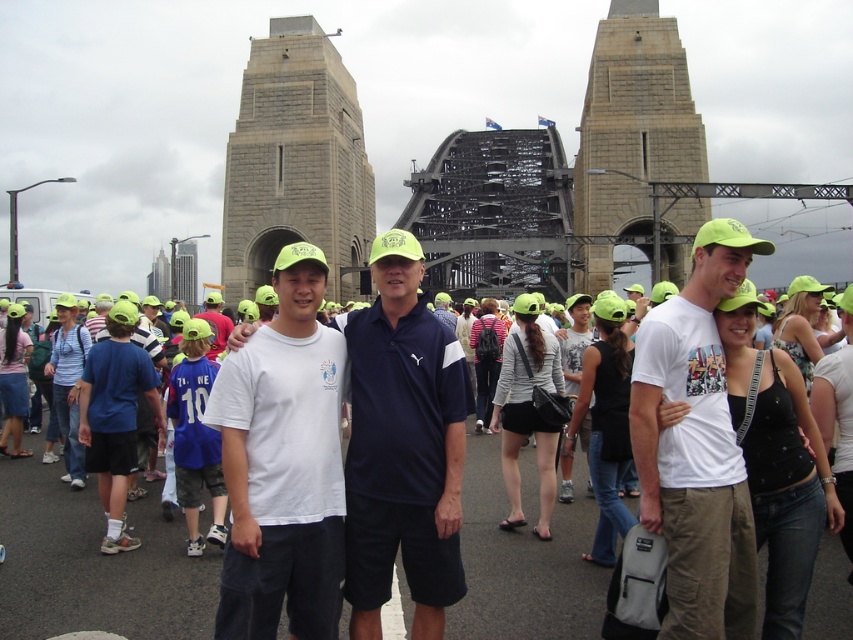
Question: Considering the real-world distances, which object is farthest from the white cotton t-shirt at center?

Choices:
 (A) white cotton shirt at center
 (B) white matte t-shirt at center

Answer: (B)

Question: Does white matte t-shirt at center have a lesser width compared to stone gray tower at center?

Choices:
 (A) yes
 (B) no

Answer: (A)

Question: Can you confirm if white matte t-shirt at center is positioned below white cotton shirt at center?

Choices:
 (A) yes
 (B) no

Answer: (B)

Question: Considering the real-world distances, which object is closest to the white cotton shirt at center?

Choices:
 (A) white fabric people at center
 (B) white matte t-shirt at center
 (C) gray stone tower at center
 (D) white cotton t-shirt at center

Answer: (B)

Question: Can you confirm if white fabric people at center is wider than white cotton shirt at center?

Choices:
 (A) yes
 (B) no

Answer: (A)

Question: Which object is the closest to the white matte t-shirt at center?

Choices:
 (A) white cotton shirt at center
 (B) gray stone tower at center

Answer: (A)